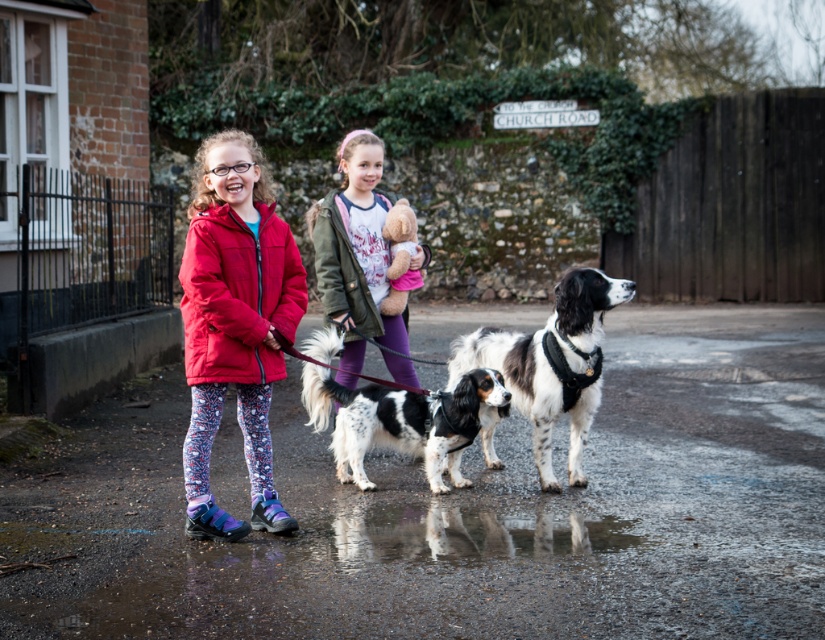
Between black and white fur at center and glossy reflective puddle at lower center, which one has more height?

Standing taller between the two is black and white fur at center.

Is black and white fur at center taller than glossy reflective puddle at lower center?

Yes.

Where is `black and white fur at center`? This screenshot has height=640, width=825. black and white fur at center is located at coordinates (550, 364).

From the picture: Is spotted fur dog at center bigger than matte green jacket at center?

Indeed, spotted fur dog at center has a larger size compared to matte green jacket at center.

Is spotted fur dog at center wider than matte green jacket at center?

Yes.

Does point (343, 429) lie in front of point (343, 273)?

Yes, point (343, 429) is in front of point (343, 273).

Where is `spotted fur dog at center`? This screenshot has width=825, height=640. spotted fur dog at center is located at coordinates (397, 417).

Who is positioned more to the right, matte green jacket at center or glossy reflective puddle at lower center?

Positioned to the right is glossy reflective puddle at lower center.

Identify the location of matte green jacket at center. The width and height of the screenshot is (825, 640). (356, 253).